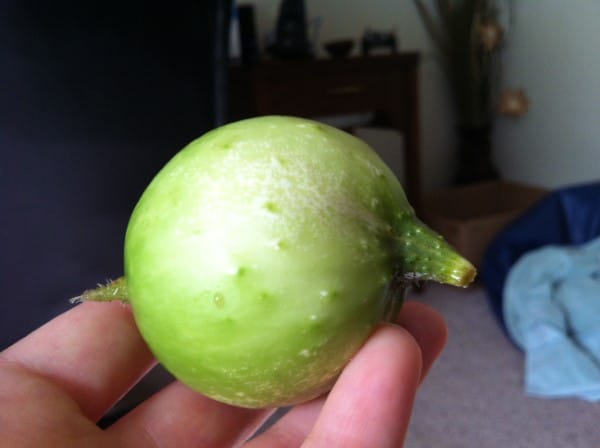
Where is `wall`? The image size is (600, 448). wall is located at coordinates (574, 72).